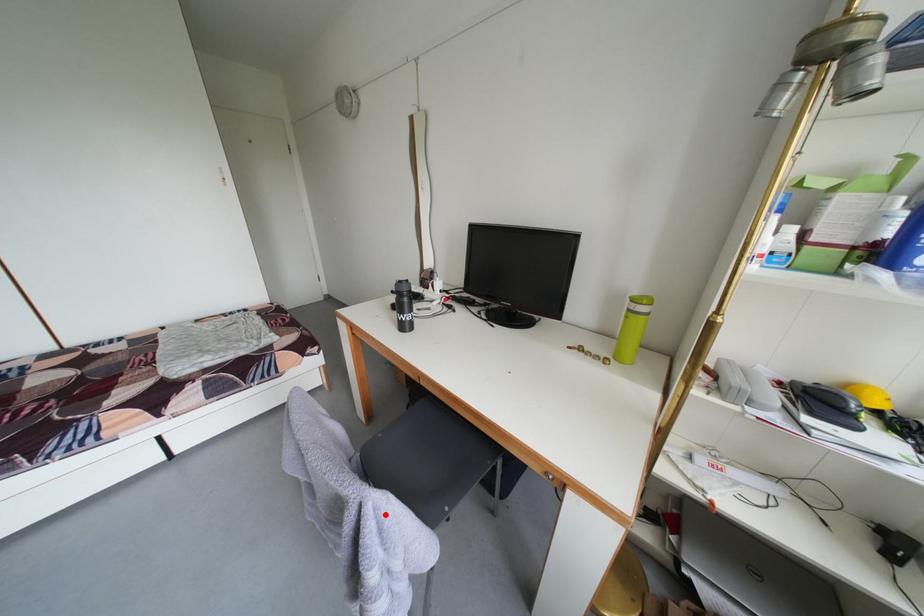
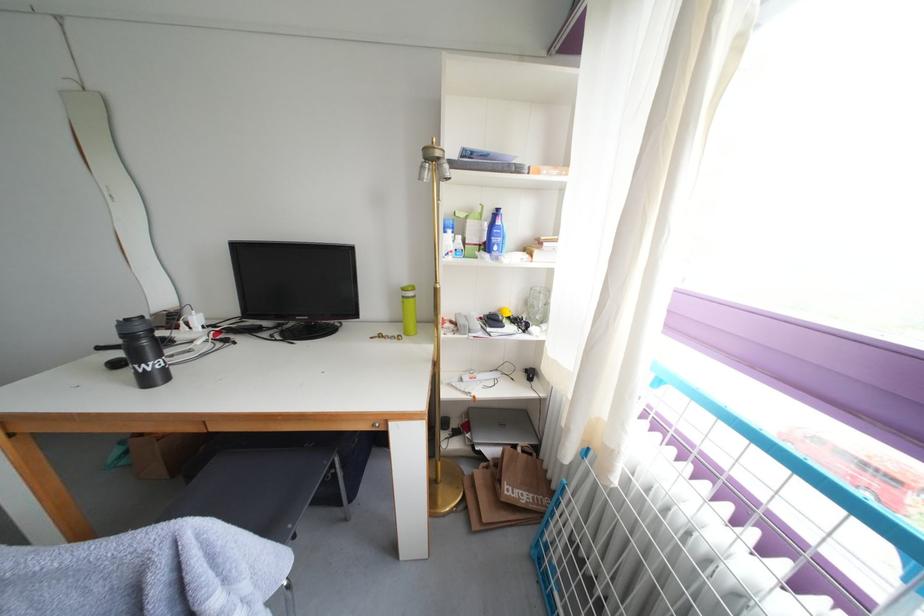
Find the pixel in the second image that matches the highlighted location in the first image.

(208, 541)